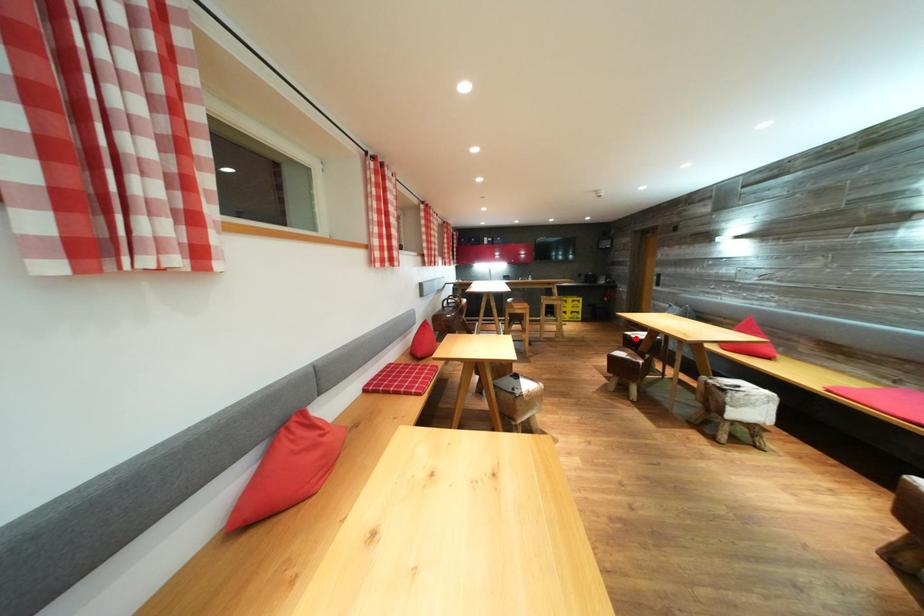
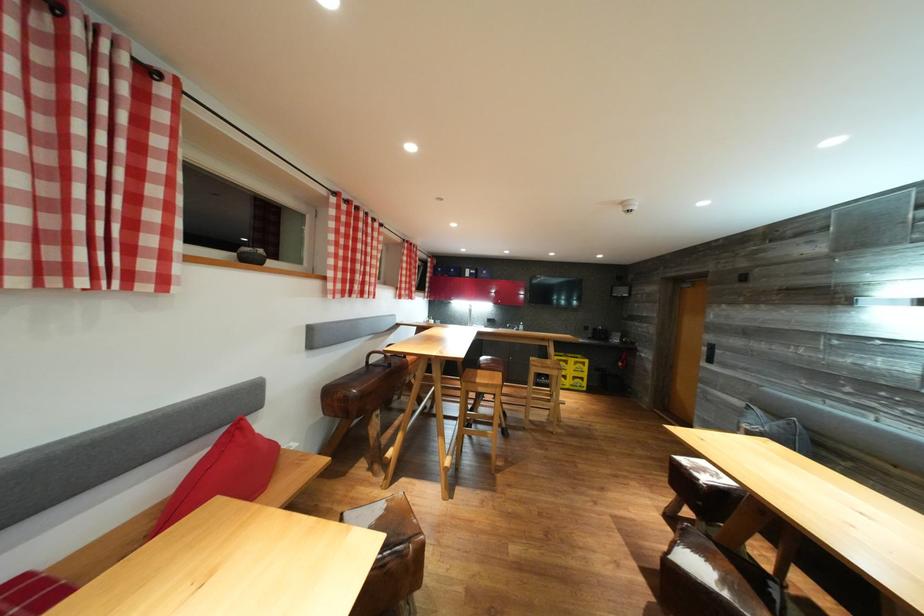
Question: I am providing you with two images of the same scene from different viewpoints. In image1, a red point is highlighted. Considering the same 3D point in image2, which of the following is correct?

Choices:
 (A) It is closer
 (B) It is farther

Answer: (B)